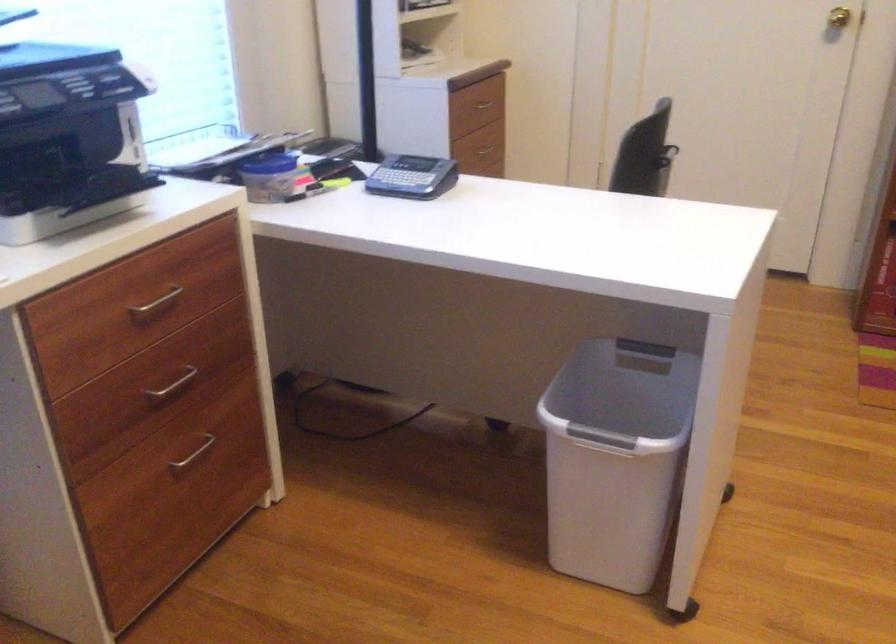
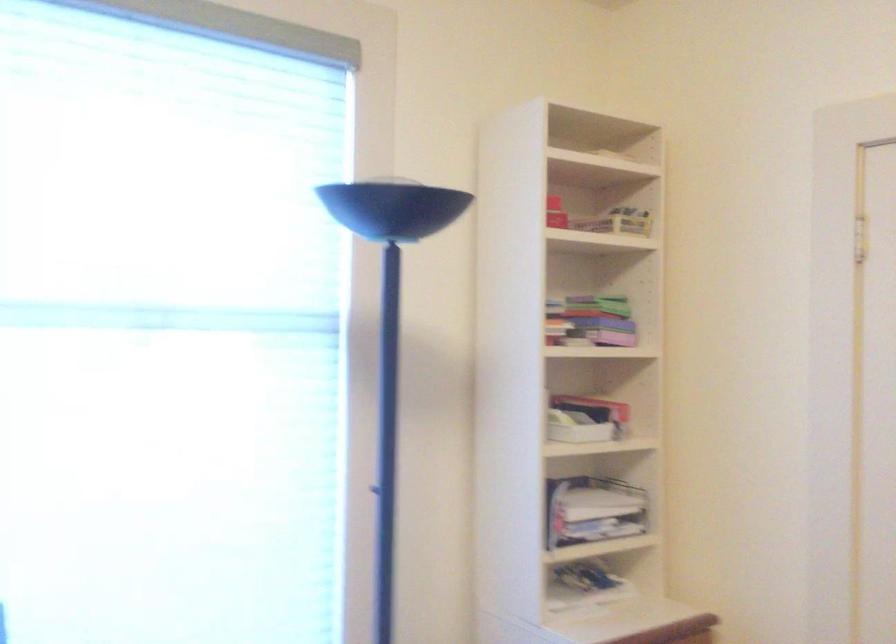
First-person continuous shooting, in which direction is the camera rotating?

The camera's rotation is toward left-up.